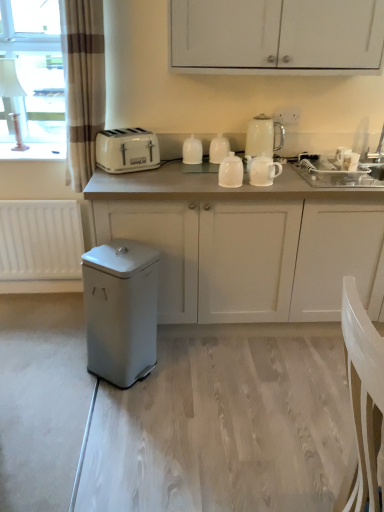
At what (x,y) coordinates should I click in order to perform the action: click on vacant space in front of white matte radiator at lower left. Please return your answer as a coordinate pair (x, y). Looking at the image, I should click on (35, 320).